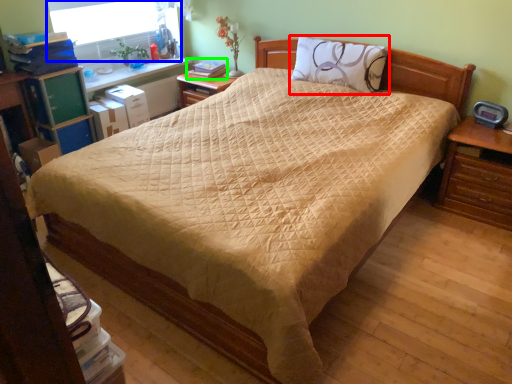
Question: Which is nearer to the pillow (highlighted by a red box)? window screen (highlighted by a blue box) or book (highlighted by a green box).

Choices:
 (A) window screen
 (B) book

Answer: (B)